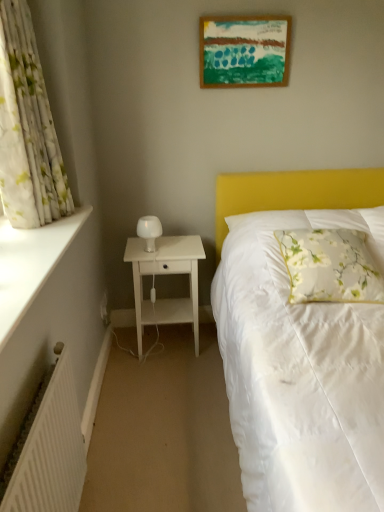
Question: From the image's perspective, is white matte nightstand at left over wooden picture frame at upper center?

Choices:
 (A) yes
 (B) no

Answer: (B)

Question: Is white matte nightstand at left aimed at wooden picture frame at upper center?

Choices:
 (A) yes
 (B) no

Answer: (B)

Question: Are white matte nightstand at left and wooden picture frame at upper center far apart?

Choices:
 (A) yes
 (B) no

Answer: (A)

Question: Does white matte nightstand at left have a lesser height compared to wooden picture frame at upper center?

Choices:
 (A) no
 (B) yes

Answer: (A)

Question: Is white matte nightstand at left bigger than wooden picture frame at upper center?

Choices:
 (A) yes
 (B) no

Answer: (A)

Question: Can wooden picture frame at upper center be found inside white matte nightstand at left?

Choices:
 (A) no
 (B) yes

Answer: (A)

Question: Considering the relative positions of floral fabric pillow at right and white smooth window sill at left in the image provided, is floral fabric pillow at right to the left of white smooth window sill at left from the viewer's perspective?

Choices:
 (A) yes
 (B) no

Answer: (B)

Question: Considering the relative sizes of floral fabric pillow at right and white smooth window sill at left in the image provided, is floral fabric pillow at right thinner than white smooth window sill at left?

Choices:
 (A) no
 (B) yes

Answer: (A)

Question: Can you confirm if floral fabric pillow at right is bigger than white smooth window sill at left?

Choices:
 (A) no
 (B) yes

Answer: (B)

Question: Does floral fabric pillow at right appear on the right side of white smooth window sill at left?

Choices:
 (A) no
 (B) yes

Answer: (B)

Question: Is floral fabric pillow at right positioned far away from white smooth window sill at left?

Choices:
 (A) no
 (B) yes

Answer: (B)

Question: Does floral fabric pillow at right have a greater width compared to white smooth window sill at left?

Choices:
 (A) no
 (B) yes

Answer: (B)

Question: Is white ribbed radiator at lower left not close to floral fabric pillow at right?

Choices:
 (A) yes
 (B) no

Answer: (A)